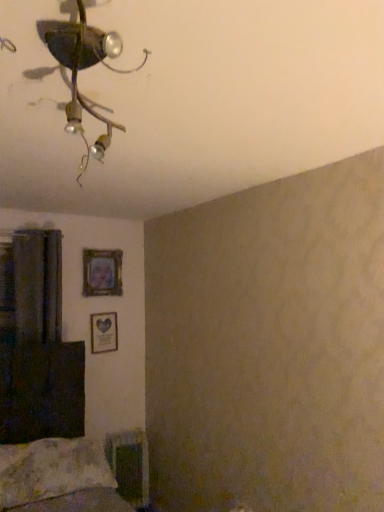
Question: From a real-world perspective, is metallic ceiling fixture at upper left below matte wooden picture frame at upper left, which is the second picture frame in bottom-to-top order?

Choices:
 (A) no
 (B) yes

Answer: (A)

Question: From a real-world perspective, is metallic ceiling fixture at upper left over matte wooden picture frame at upper left, which is the second picture frame in bottom-to-top order?

Choices:
 (A) yes
 (B) no

Answer: (A)

Question: Considering the relative positions of metallic ceiling fixture at upper left and matte wooden picture frame at upper left, acting as the 1th picture frame starting from the top, in the image provided, is metallic ceiling fixture at upper left to the right of matte wooden picture frame at upper left, acting as the 1th picture frame starting from the top, from the viewer's perspective?

Choices:
 (A) yes
 (B) no

Answer: (A)

Question: Is metallic ceiling fixture at upper left oriented towards matte wooden picture frame at upper left, which is the second picture frame in bottom-to-top order?

Choices:
 (A) no
 (B) yes

Answer: (A)

Question: Is matte wooden picture frame at upper left, acting as the 1th picture frame starting from the top, completely or partially inside metallic ceiling fixture at upper left?

Choices:
 (A) no
 (B) yes

Answer: (A)

Question: In terms of height, does wooden picture frame at center-left, marked as the second picture frame in a top-to-bottom arrangement, look taller or shorter compared to matte wooden picture frame at upper left, acting as the 1th picture frame starting from the top?

Choices:
 (A) short
 (B) tall

Answer: (A)

Question: Looking at their shapes, would you say wooden picture frame at center-left, which is the 1th picture frame from bottom to top, is wider or thinner than matte wooden picture frame at upper left, acting as the 1th picture frame starting from the top?

Choices:
 (A) wide
 (B) thin

Answer: (B)

Question: Relative to matte wooden picture frame at upper left, which is the second picture frame in bottom-to-top order, is wooden picture frame at center-left, which is the 1th picture frame from bottom to top, in front or behind?

Choices:
 (A) behind
 (B) front

Answer: (A)

Question: From a real-world perspective, relative to matte wooden picture frame at upper left, which is the second picture frame in bottom-to-top order, is wooden picture frame at center-left, marked as the second picture frame in a top-to-bottom arrangement, vertically above or below?

Choices:
 (A) below
 (B) above

Answer: (A)

Question: From the image's perspective, is wooden picture frame at center-left, marked as the second picture frame in a top-to-bottom arrangement, above or below fluffy white pillow at lower left?

Choices:
 (A) above
 (B) below

Answer: (A)

Question: Is point (109, 317) positioned closer to the camera than point (36, 446)?

Choices:
 (A) farther
 (B) closer

Answer: (A)

Question: Is wooden picture frame at center-left, marked as the second picture frame in a top-to-bottom arrangement, taller or shorter than fluffy white pillow at lower left?

Choices:
 (A) short
 (B) tall

Answer: (B)

Question: Relative to fluffy white pillow at lower left, is wooden picture frame at center-left, which is the 1th picture frame from bottom to top, in front or behind?

Choices:
 (A) behind
 (B) front

Answer: (A)

Question: Which is correct: matte wooden picture frame at upper left, acting as the 1th picture frame starting from the top, is inside metallic ceiling fixture at upper left, or outside of it?

Choices:
 (A) outside
 (B) inside

Answer: (A)

Question: From a real-world perspective, relative to metallic ceiling fixture at upper left, is matte wooden picture frame at upper left, acting as the 1th picture frame starting from the top, vertically above or below?

Choices:
 (A) above
 (B) below

Answer: (B)